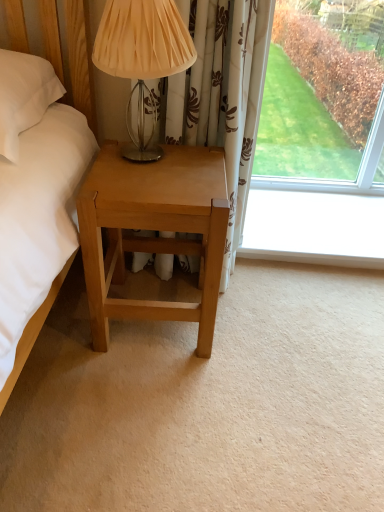
Question: Considering the relative sizes of light brown wood nightstand at lower left and matte beige fabric at upper center in the image provided, is light brown wood nightstand at lower left wider than matte beige fabric at upper center?

Choices:
 (A) no
 (B) yes

Answer: (B)

Question: Considering the relative sizes of light brown wood nightstand at lower left and matte beige fabric at upper center in the image provided, is light brown wood nightstand at lower left bigger than matte beige fabric at upper center?

Choices:
 (A) yes
 (B) no

Answer: (A)

Question: From the image's perspective, is light brown wood nightstand at lower left located beneath matte beige fabric at upper center?

Choices:
 (A) yes
 (B) no

Answer: (A)

Question: Is there a large distance between light brown wood nightstand at lower left and matte beige fabric at upper center?

Choices:
 (A) no
 (B) yes

Answer: (A)

Question: Can you confirm if light brown wood nightstand at lower left is positioned to the left of matte beige fabric at upper center?

Choices:
 (A) no
 (B) yes

Answer: (A)

Question: From a real-world perspective, is light brown wood nightstand at lower left positioned over matte beige fabric at upper center based on gravity?

Choices:
 (A) yes
 (B) no

Answer: (B)

Question: Does matte beige fabric at upper center have a greater width compared to light brown wood nightstand at lower left?

Choices:
 (A) no
 (B) yes

Answer: (A)

Question: Considering the relative sizes of matte beige fabric at upper center and light brown wood nightstand at lower left in the image provided, is matte beige fabric at upper center thinner than light brown wood nightstand at lower left?

Choices:
 (A) no
 (B) yes

Answer: (B)

Question: Is matte beige fabric at upper center facing towards light brown wood nightstand at lower left?

Choices:
 (A) yes
 (B) no

Answer: (B)

Question: Considering the relative sizes of matte beige fabric at upper center and light brown wood nightstand at lower left in the image provided, is matte beige fabric at upper center taller than light brown wood nightstand at lower left?

Choices:
 (A) no
 (B) yes

Answer: (A)

Question: Does matte beige fabric at upper center have a larger size compared to light brown wood nightstand at lower left?

Choices:
 (A) no
 (B) yes

Answer: (A)

Question: Is matte beige fabric at upper center turned away from light brown wood nightstand at lower left?

Choices:
 (A) yes
 (B) no

Answer: (B)

Question: In terms of height, does light brown wood nightstand at lower left look taller or shorter compared to matte beige fabric at upper center?

Choices:
 (A) tall
 (B) short

Answer: (A)